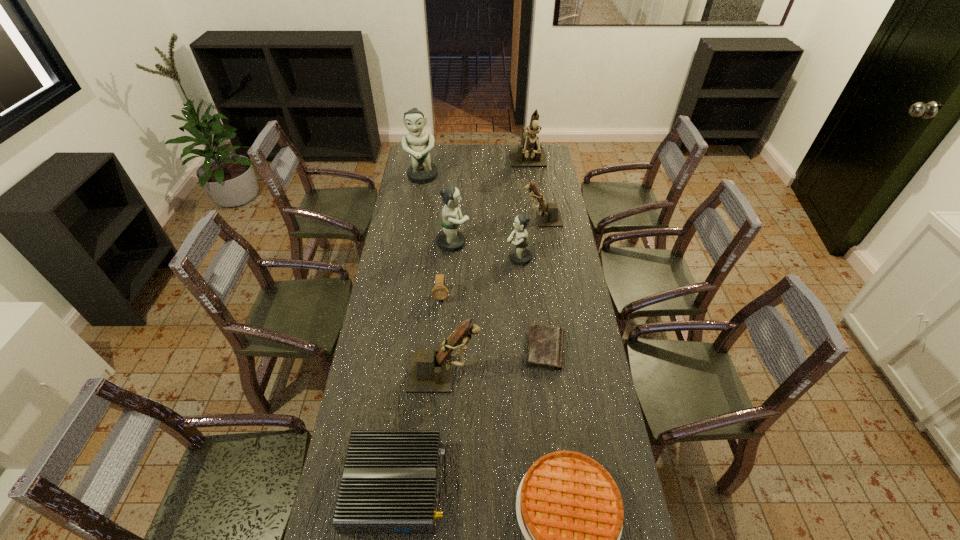
I want to click on free space located on the front-facing side of the smallest green figurine, so click(x=418, y=258).

This screenshot has height=540, width=960. What are the coordinates of `vacant space located 0.380m on the front-facing side of the smallest green figurine` in the screenshot? It's located at (418, 258).

In order to click on vacant space positioned 0.120m on the front-facing side of the smallest green figurine in this screenshot , I will do `click(478, 258)`.

At what (x,y) coordinates should I click in order to perform the action: click on free region located on the face of the fourth shortest object. Please return your answer as a coordinate pair (x, y). Looking at the image, I should click on (434, 391).

Locate an element on the screen. blank space located on the back panel of the third shortest object is located at coordinates (474, 486).

Image resolution: width=960 pixels, height=540 pixels. I want to click on free spot located on the front of the shortest object, so click(555, 431).

At what (x,y) coordinates should I click in order to perform the action: click on object at the far edge. Please return your answer as a coordinate pair (x, y). This screenshot has width=960, height=540. Looking at the image, I should click on (528, 154).

Where is `figurine located at the left edge`? figurine located at the left edge is located at coordinates (422, 171).

You are a GUI agent. You are given a task and a screenshot of the screen. Output one action in this format:
    pyautogui.click(x=<x>, y=<y>)
    Task: Click on the router located at the left edge
    The image size is (960, 540).
    Given the screenshot: What is the action you would take?
    pyautogui.click(x=390, y=480)

Image resolution: width=960 pixels, height=540 pixels. Identify the location of diary that is at the right edge. (545, 344).